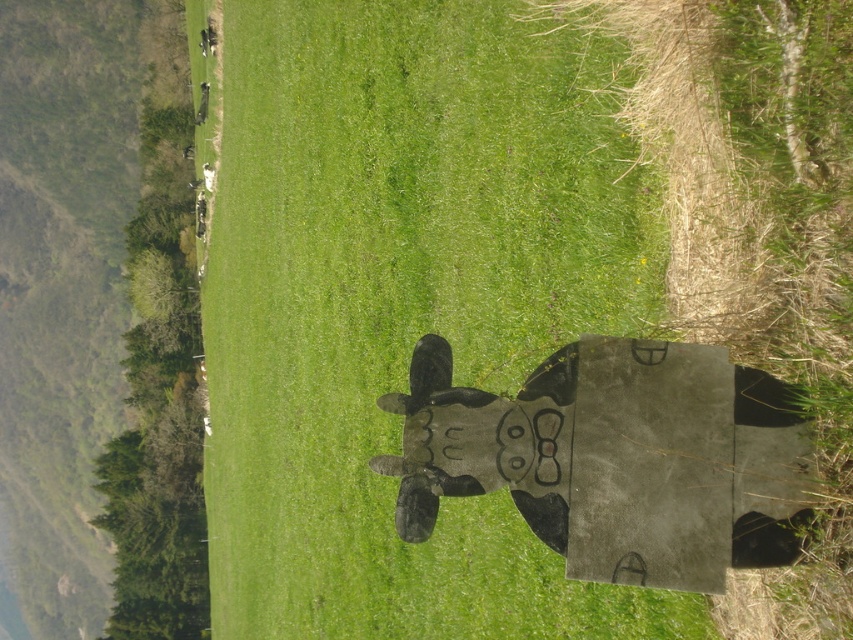
Question: Which of the following is the farthest from the observer?

Choices:
 (A) black matte cow at center
 (B) wooden cow at center

Answer: (B)

Question: Can you confirm if wooden cow at center is positioned above black matte cow at center?

Choices:
 (A) no
 (B) yes

Answer: (B)

Question: Considering the relative positions of wooden cow at center and black matte cow at center in the image provided, where is wooden cow at center located with respect to black matte cow at center?

Choices:
 (A) left
 (B) right

Answer: (A)

Question: Does wooden cow at center have a larger size compared to black matte cow at center?

Choices:
 (A) yes
 (B) no

Answer: (A)

Question: Which point is farther to the camera?

Choices:
 (A) (622, 621)
 (B) (622, 481)

Answer: (A)